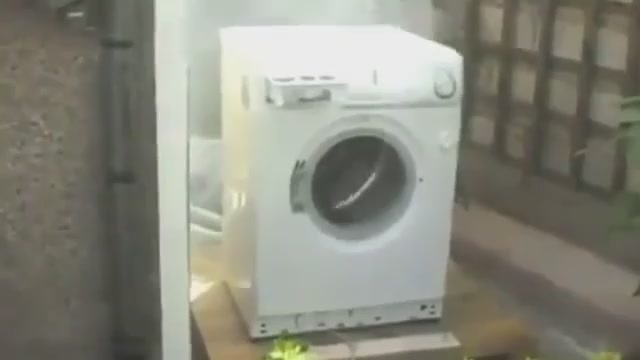
The image size is (640, 360). In order to click on washer door in this screenshot , I will do `click(365, 186)`.